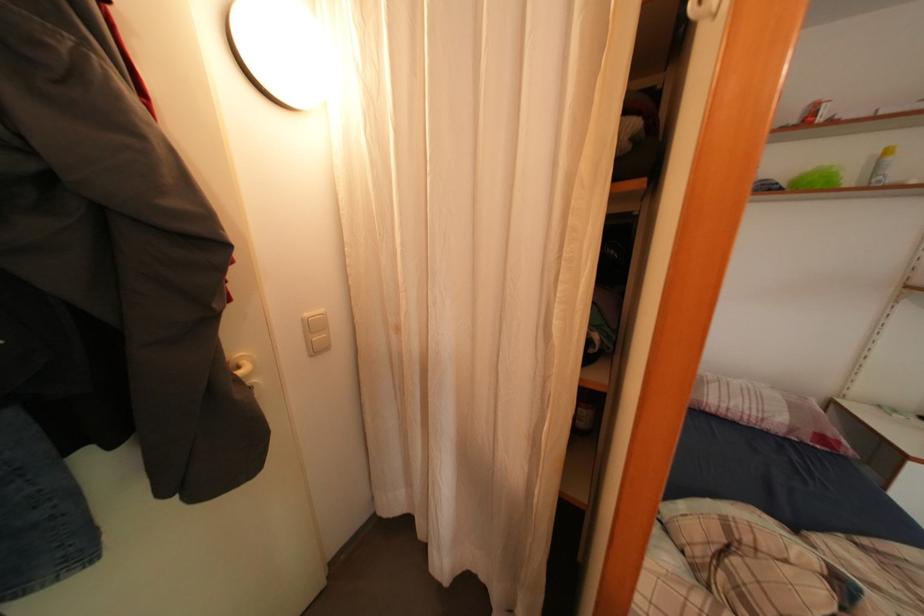
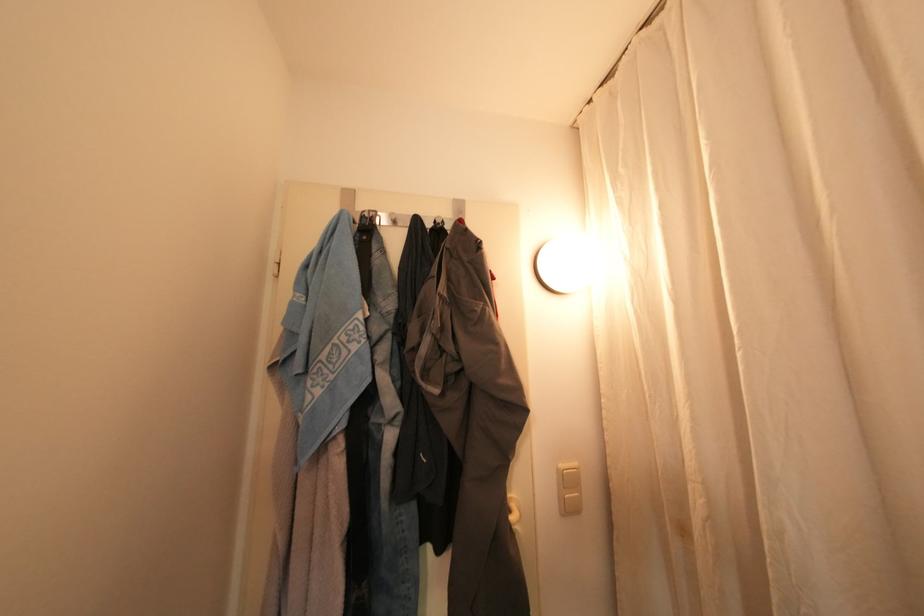
Locate, in the second image, the point that corresponds to pixel 245 374 in the first image.

(517, 519)